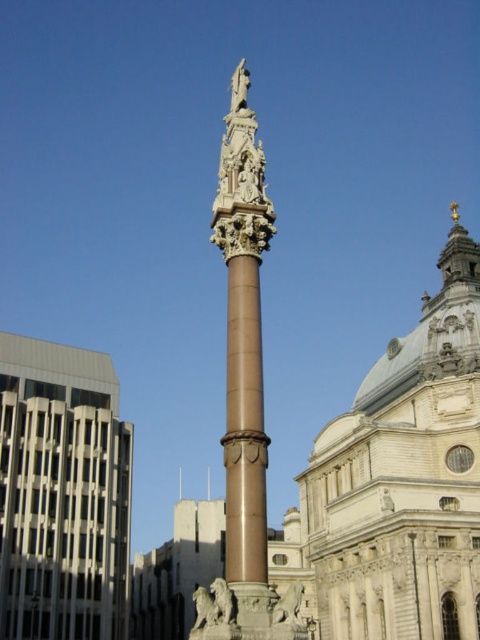
How much distance is there between white glass building at left and bronze/golden column at center?

white glass building at left and bronze/golden column at center are 62.72 feet apart.

Is white glass building at left smaller than bronze/golden column at center?

Yes.

Is point (36, 628) closer to viewer compared to point (240, 301)?

No.

This screenshot has width=480, height=640. Identify the location of white glass building at left. (61, 493).

Is point (414, 632) less distant than point (245, 467)?

No.

Does light beige stone tower at center have a greater height compared to bronze/golden column at center?

Incorrect, light beige stone tower at center's height is not larger of bronze/golden column at center's.

Describe the element at coordinates (404, 477) in the screenshot. I see `light beige stone tower at center` at that location.

Identify the location of light beige stone tower at center. This screenshot has width=480, height=640. (404, 477).

Who is lower down, light beige stone tower at center or white glass building at left?

white glass building at left is lower down.

Between light beige stone tower at center and white glass building at left, which one appears on the right side from the viewer's perspective?

From the viewer's perspective, light beige stone tower at center appears more on the right side.

Does point (389, 422) lie behind point (52, 353)?

No, (389, 422) is in front of (52, 353).

The height and width of the screenshot is (640, 480). What are the coordinates of `light beige stone tower at center` in the screenshot? It's located at (404, 477).